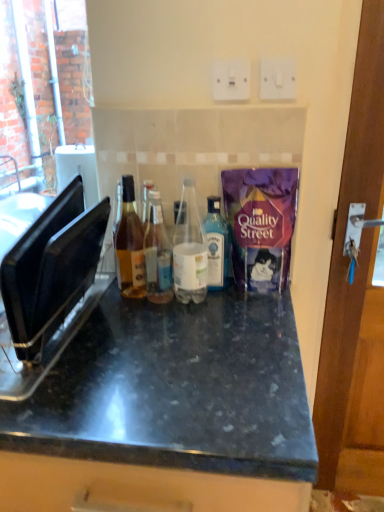
The image size is (384, 512). Find the location of `vacant point to the left of translucent glass bottle at center, which is counted as the 3th bottle, starting from the right`. vacant point to the left of translucent glass bottle at center, which is counted as the 3th bottle, starting from the right is located at coordinates (100, 302).